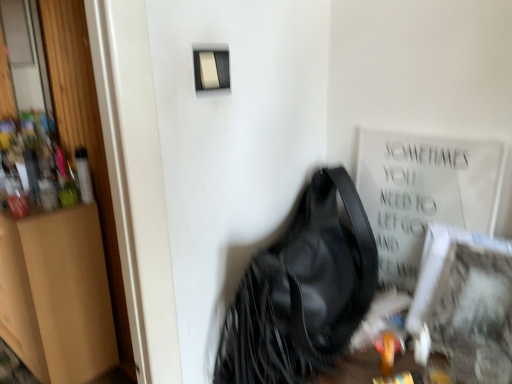
The height and width of the screenshot is (384, 512). What do you see at coordinates (211, 69) in the screenshot? I see `matte plastic light switch at upper center` at bounding box center [211, 69].

This screenshot has width=512, height=384. Find the location of `matte plastic light switch at upper center`. matte plastic light switch at upper center is located at coordinates click(x=211, y=69).

At what (x,y) coordinates should I click in order to perform the action: click on white textured frame at lower right. Please return your answer as a coordinate pair (x, y). This screenshot has height=384, width=512. Looking at the image, I should click on (465, 303).

Is black leather handbag at center not near white textured frame at lower right?

Actually, black leather handbag at center and white textured frame at lower right are a little close together.

Does black leather handbag at center contain white textured frame at lower right?

Definitely not — white textured frame at lower right is not inside black leather handbag at center.

Is black leather handbag at center closer to camera compared to white textured frame at lower right?

Yes, black leather handbag at center is closer to the camera.

Is matte plastic light switch at upper center not near black leather handbag at center?

matte plastic light switch at upper center is near black leather handbag at center, not far away.

From a real-world perspective, who is located higher, matte plastic light switch at upper center or black leather handbag at center?

matte plastic light switch at upper center is physically above.

Considering the relative positions of matte plastic light switch at upper center and black leather handbag at center in the image provided, is matte plastic light switch at upper center to the right of black leather handbag at center from the viewer's perspective?

Incorrect, matte plastic light switch at upper center is not on the right side of black leather handbag at center.

Does point (223, 74) come behind point (262, 300)?

That is False.

In the image, there is a matte plastic light switch at upper center. At what (x,y) coordinates should I click in order to perform the action: click on dresser below it (from the image's perspective). Please return your answer as a coordinate pair (x, y). The height and width of the screenshot is (384, 512). Looking at the image, I should click on (57, 295).

Is point (209, 70) closer to camera compared to point (83, 244)?

Yes, it is in front of point (83, 244).

From the image's perspective, is matte plastic light switch at upper center below brown cardboard dresser at left?

No.

Considering the sizes of matte plastic light switch at upper center and brown cardboard dresser at left in the image, is matte plastic light switch at upper center bigger or smaller than brown cardboard dresser at left?

Clearly, matte plastic light switch at upper center is smaller in size than brown cardboard dresser at left.

Locate an element on the screen. The width and height of the screenshot is (512, 384). light switch on the left of the black leather handbag at center is located at coordinates coord(211,69).

Which is nearer, (326, 177) or (213, 88)?

The point (213, 88) is closer.

Considering the sizes of objects black leather handbag at center and matte plastic light switch at upper center in the image provided, who is bigger, black leather handbag at center or matte plastic light switch at upper center?

With larger size is black leather handbag at center.

Considering the sizes of matte plastic light switch at upper center and white textured frame at lower right in the image, is matte plastic light switch at upper center wider or thinner than white textured frame at lower right?

Clearly, matte plastic light switch at upper center has less width compared to white textured frame at lower right.

Would you say matte plastic light switch at upper center is to the left or to the right of white textured frame at lower right in the picture?

matte plastic light switch at upper center is positioned on white textured frame at lower right's left side.

Which object is closer to the camera, matte plastic light switch at upper center or white textured frame at lower right?

white textured frame at lower right is more forward.

Does point (439, 297) appear closer or farther from the camera than point (34, 278)?

Clearly, point (439, 297) is closer to the camera than point (34, 278).

Is the surface of white textured frame at lower right in direct contact with brown cardboard dresser at left?

No, white textured frame at lower right is not making contact with brown cardboard dresser at left.

Can you confirm if white textured frame at lower right is positioned to the right of brown cardboard dresser at left?

Indeed, white textured frame at lower right is positioned on the right side of brown cardboard dresser at left.

Is brown cardboard dresser at left located within white textured frame at lower right?

That's incorrect, brown cardboard dresser at left is not inside white textured frame at lower right.

Can you confirm if brown cardboard dresser at left is smaller than black leather handbag at center?

Actually, brown cardboard dresser at left might be larger than black leather handbag at center.

Would you say brown cardboard dresser at left is outside black leather handbag at center?

That's correct, brown cardboard dresser at left is outside of black leather handbag at center.

From the image's perspective, is brown cardboard dresser at left positioned above or below black leather handbag at center?

From the image's perspective, brown cardboard dresser at left appears below black leather handbag at center.

Based on their positions, is brown cardboard dresser at left located to the left or right of black leather handbag at center?

Clearly, brown cardboard dresser at left is on the left of black leather handbag at center in the image.

Find the location of a particular element. Image resolution: width=512 pixels, height=384 pixels. handbag below the white textured frame at lower right (from a real-world perspective) is located at coordinates (302, 291).

At what (x,y) coordinates should I click in order to perform the action: click on handbag below the matte plastic light switch at upper center (from the image's perspective). Please return your answer as a coordinate pair (x, y). The height and width of the screenshot is (384, 512). Looking at the image, I should click on (302, 291).

From the image, which object appears to be farther from matte plastic light switch at upper center, white textured frame at lower right or brown cardboard dresser at left?

brown cardboard dresser at left lies further to matte plastic light switch at upper center than the other object.

From the image, which object appears to be farther from matte plastic light switch at upper center, white textured frame at lower right or black leather handbag at center?

white textured frame at lower right.

Which object lies further to the anchor point white textured frame at lower right, brown cardboard dresser at left or matte plastic light switch at upper center?

brown cardboard dresser at left is further to white textured frame at lower right.

Based on their spatial positions, is brown cardboard dresser at left or white textured frame at lower right closer to matte plastic light switch at upper center?

Based on the image, white textured frame at lower right appears to be nearer to matte plastic light switch at upper center.

From the image, which object appears to be farther from black leather handbag at center, matte plastic light switch at upper center or brown cardboard dresser at left?

Based on the image, brown cardboard dresser at left appears to be further to black leather handbag at center.

Based on their spatial positions, is white textured frame at lower right or brown cardboard dresser at left closer to black leather handbag at center?

white textured frame at lower right is closer to black leather handbag at center.

Based on their spatial positions, is white textured frame at lower right or black leather handbag at center closer to brown cardboard dresser at left?

Based on the image, black leather handbag at center appears to be nearer to brown cardboard dresser at left.

From the image, which object appears to be farther from brown cardboard dresser at left, white textured frame at lower right or matte plastic light switch at upper center?

Based on the image, white textured frame at lower right appears to be further to brown cardboard dresser at left.

This screenshot has width=512, height=384. Identify the location of light switch between brown cardboard dresser at left and black leather handbag at center in the horizontal direction. (211, 69).

This screenshot has height=384, width=512. I want to click on handbag between brown cardboard dresser at left and white textured frame at lower right from left to right, so click(302, 291).

I want to click on picture frame that lies between matte plastic light switch at upper center and black leather handbag at center from top to bottom, so click(465, 303).

Find the location of `light switch between brown cardboard dresser at left and white textured frame at lower right from left to right`. light switch between brown cardboard dresser at left and white textured frame at lower right from left to right is located at coordinates (211, 69).